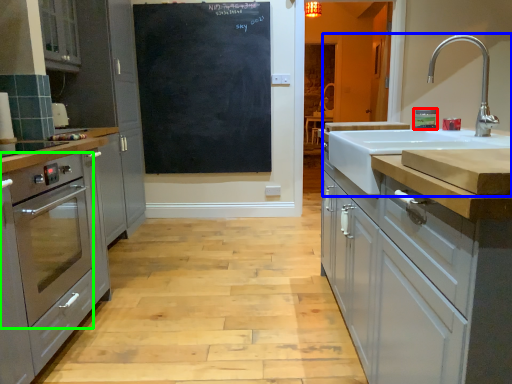
Question: Estimate the real-world distances between objects in this image. Which object is closer to appliance (highlighted by a red box), sink (highlighted by a blue box) or home appliance (highlighted by a green box)?

Choices:
 (A) sink
 (B) home appliance

Answer: (A)